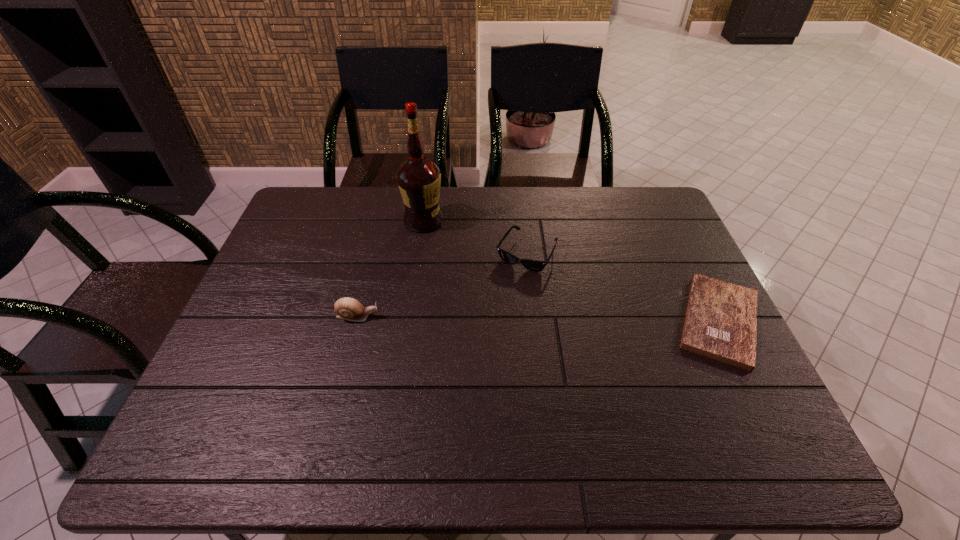
This screenshot has height=540, width=960. Identify the location of free space at the left edge. (268, 273).

Locate an element on the screen. This screenshot has width=960, height=540. free space at the right edge of the desktop is located at coordinates (652, 295).

Find the location of a particular element. The image size is (960, 540). vacant area that lies between the rightmost object and the leftmost object is located at coordinates (539, 319).

I want to click on free space between the Bible and the third tallest object, so click(x=623, y=287).

What are the coordinates of `vacant point located between the third shortest object and the third object from right to left` in the screenshot? It's located at tap(391, 269).

Where is `free space between the third object from right to left and the second shortest object`? free space between the third object from right to left and the second shortest object is located at coordinates (475, 237).

You are a GUI agent. You are given a task and a screenshot of the screen. Output one action in this format:
    pyautogui.click(x=<x>, y=<y>)
    Task: Click on the unoccupied area between the third shortest object and the third tallest object
    The image size is (960, 540).
    Given the screenshot: What is the action you would take?
    pos(442,285)

This screenshot has width=960, height=540. What are the coordinates of `vacant area that lies between the shortest object and the sunglasses` in the screenshot? It's located at (623, 287).

Where is `vacant point located between the shortest object and the leftmost object`? This screenshot has width=960, height=540. vacant point located between the shortest object and the leftmost object is located at coordinates (539, 319).

The height and width of the screenshot is (540, 960). Find the location of `free space between the Bible and the escargot`. free space between the Bible and the escargot is located at coordinates (539, 319).